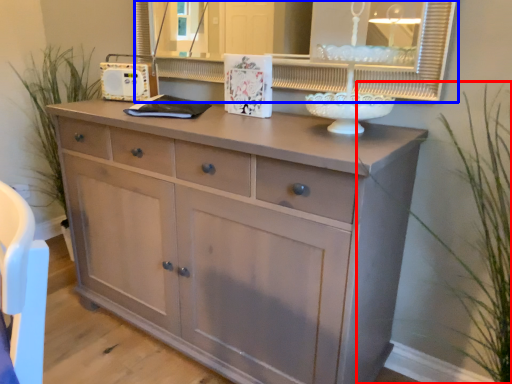
Question: Which object is closer to the camera taking this photo, plant (highlighted by a red box) or medicine cabinet (highlighted by a blue box)?

Choices:
 (A) plant
 (B) medicine cabinet

Answer: (A)